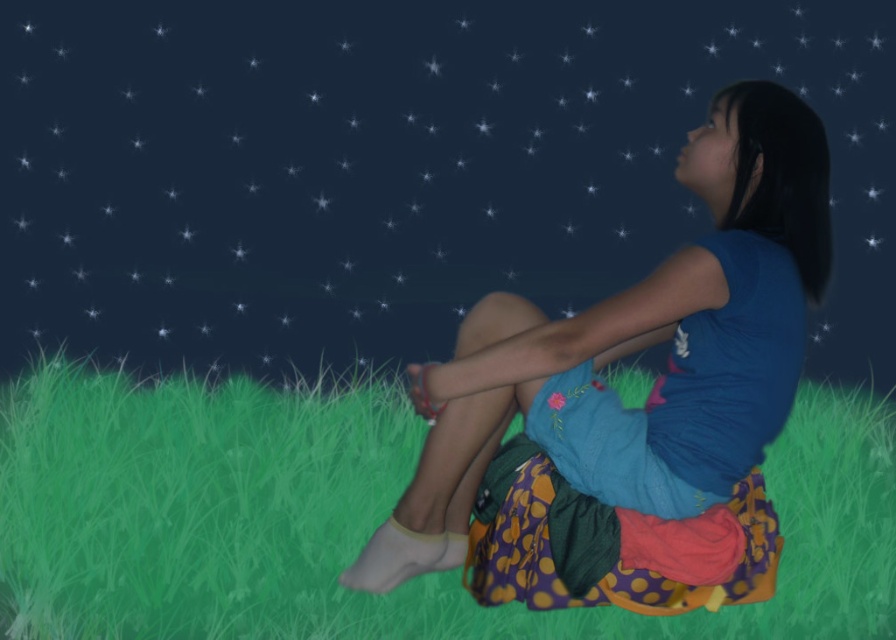
Question: Does matte blue dress at center have a lesser width compared to matte blue shirt at center?

Choices:
 (A) yes
 (B) no

Answer: (B)

Question: Which is nearer to the green grassy at lower center?

Choices:
 (A) matte blue dress at center
 (B) matte blue shirt at center

Answer: (A)

Question: Does green grassy at lower center appear on the left side of matte blue shirt at center?

Choices:
 (A) no
 (B) yes

Answer: (B)

Question: Can you confirm if green grassy at lower center is positioned below matte blue shirt at center?

Choices:
 (A) yes
 (B) no

Answer: (A)

Question: Which point is closer to the camera taking this photo?

Choices:
 (A) (177, 182)
 (B) (194, 490)
 (C) (826, 202)

Answer: (C)

Question: Which object appears farthest from the camera in this image?

Choices:
 (A) green grassy at lower center
 (B) matte blue dress at center

Answer: (B)